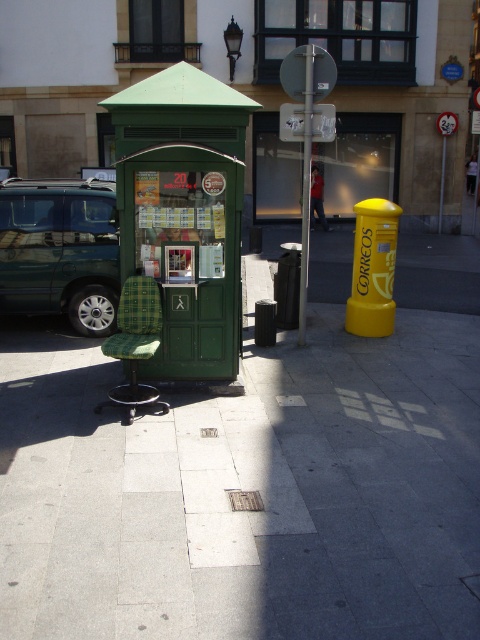
Who is more distant from viewer, (434, 240) or (22, 285)?

Point (434, 240)

Does point (335, 282) come in front of point (84, 316)?

No, it is not.

Is point (105, 570) closer to camera compared to point (101, 211)?

Yes, point (105, 570) is closer to viewer.

You are a GUI agent. You are given a task and a screenshot of the screen. Output one action in this format:
    pyautogui.click(x=<x>, y=<y>)
    Task: Click on the smooth concrete pavement at center
    
    Given the screenshot: What is the action you would take?
    pyautogui.click(x=245, y=488)

Which is above, green matte bus stop at center or metallic green van at left?

green matte bus stop at center

The height and width of the screenshot is (640, 480). What are the coordinates of `green matte bus stop at center` in the screenshot? It's located at (183, 212).

Between point (66, 280) and point (307, 179), which one is positioned behind?

Positioned behind is point (66, 280).

Is metallic green van at left below metallic silver pole at center?

Correct, metallic green van at left is located below metallic silver pole at center.

I want to click on metallic green van at left, so click(60, 250).